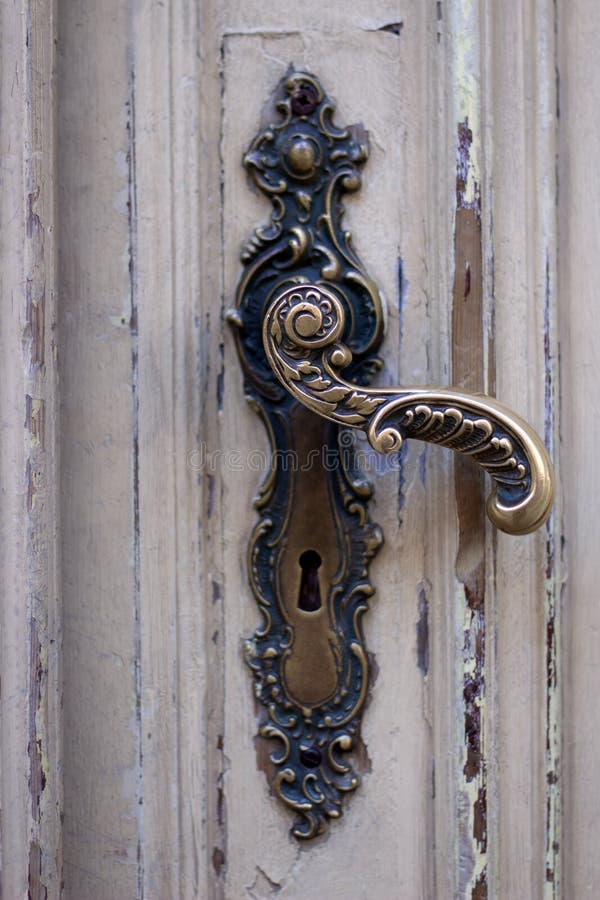
Identify the location of keyhole. click(x=311, y=577).